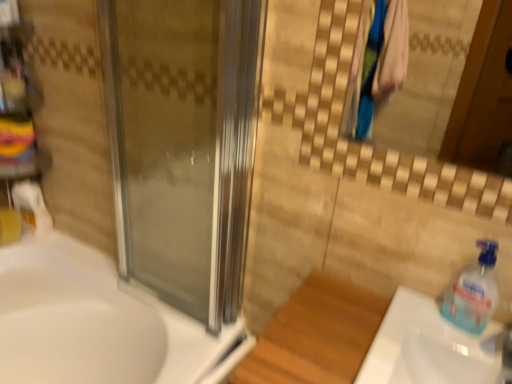
Identify the location of blank space above white glossy sink at lower right, the second sink in the back-to-front sequence (from a real-world perspective). The image size is (512, 384). (442, 337).